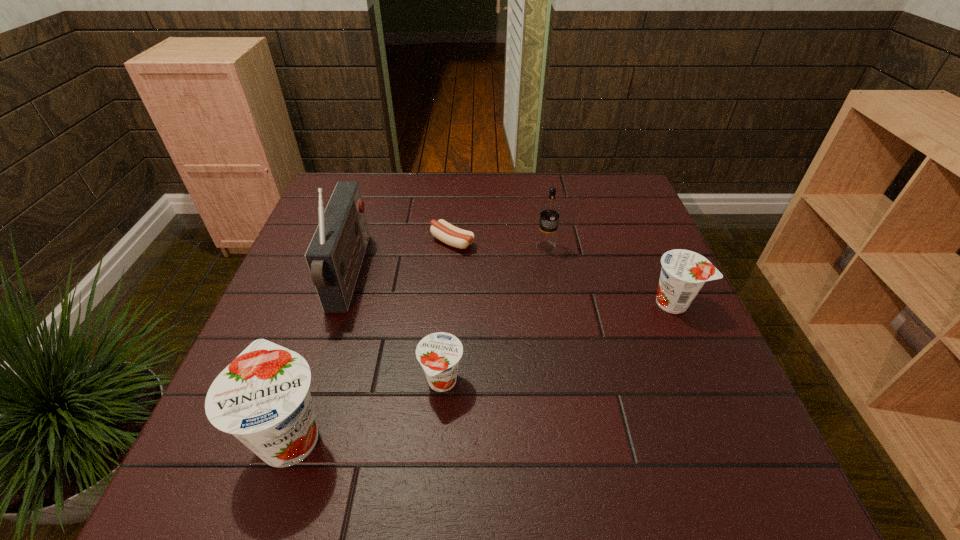
You are a GUI agent. You are given a task and a screenshot of the screen. Output one action in this format:
    pyautogui.click(x=<x>, y=<y>)
    Task: Click on the free space that satisfies the following two spatial constraints: 1. on the back side of the shortest object; 2. on the left side of the fifth tallest object
    This screenshot has height=540, width=960.
    Given the screenshot: What is the action you would take?
    pyautogui.click(x=452, y=242)